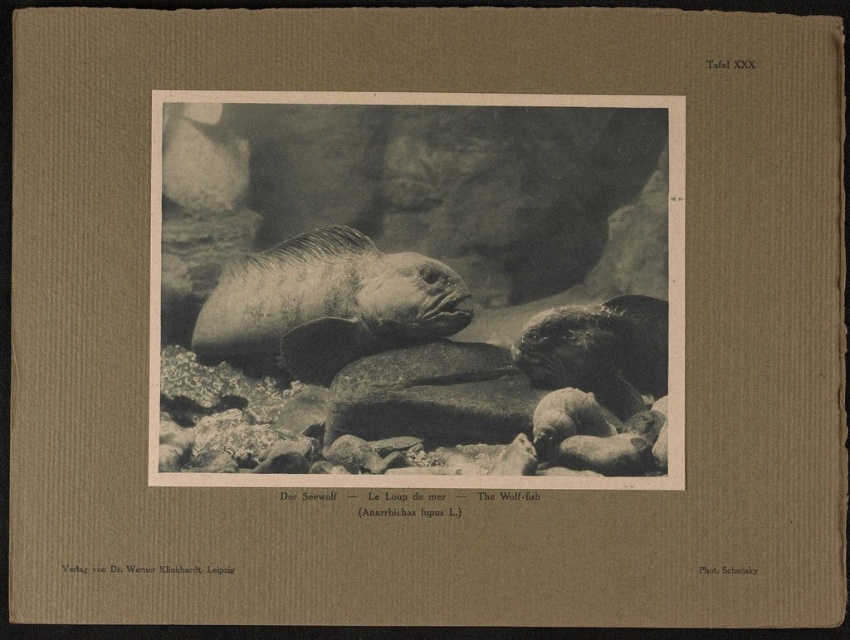
Which is in front, point (279, 266) or point (595, 365)?

Positioned in front is point (595, 365).

Describe the element at coordinates (326, 305) in the screenshot. The image size is (850, 640). I see `gray textured fish at center` at that location.

Measure the distance between point (412, 252) and camera.

Point (412, 252) is 4.72 feet away from camera.

The image size is (850, 640). Find the location of `gray textured fish at center`. gray textured fish at center is located at coordinates (326, 305).